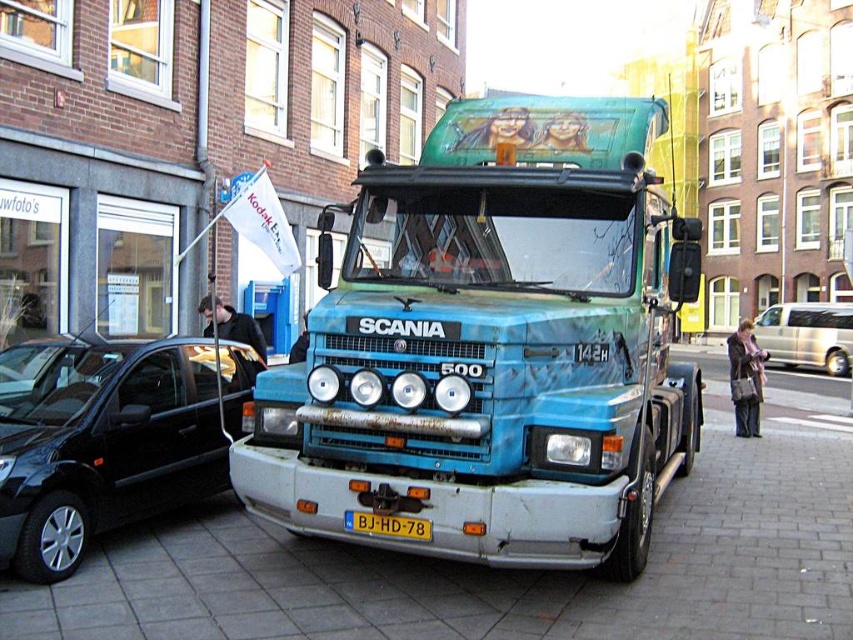
Can you confirm if blue metallic truck at center is positioned above shiny black car at left?

No, blue metallic truck at center is not above shiny black car at left.

The width and height of the screenshot is (853, 640). What are the coordinates of `blue metallic truck at center` in the screenshot? It's located at (491, 346).

In the scene shown: Is blue metallic truck at center above yellow plastic license plate at center?

Indeed, blue metallic truck at center is positioned over yellow plastic license plate at center.

Is point (332, 520) more distant than point (393, 525)?

Yes, it is.

You are a GUI agent. You are given a task and a screenshot of the screen. Output one action in this format:
    pyautogui.click(x=<x>, y=<y>)
    Task: Click on the blue metallic truck at center
    Image resolution: width=853 pixels, height=640 pixels.
    Given the screenshot: What is the action you would take?
    [x=491, y=346]

Is blue metallic truck at center positioned in front of metallic silver van at right?

Yes, it is.

Locate an element on the screen. The image size is (853, 640). blue metallic truck at center is located at coordinates (491, 346).

Where is `blue metallic truck at center`? The width and height of the screenshot is (853, 640). blue metallic truck at center is located at coordinates click(x=491, y=346).